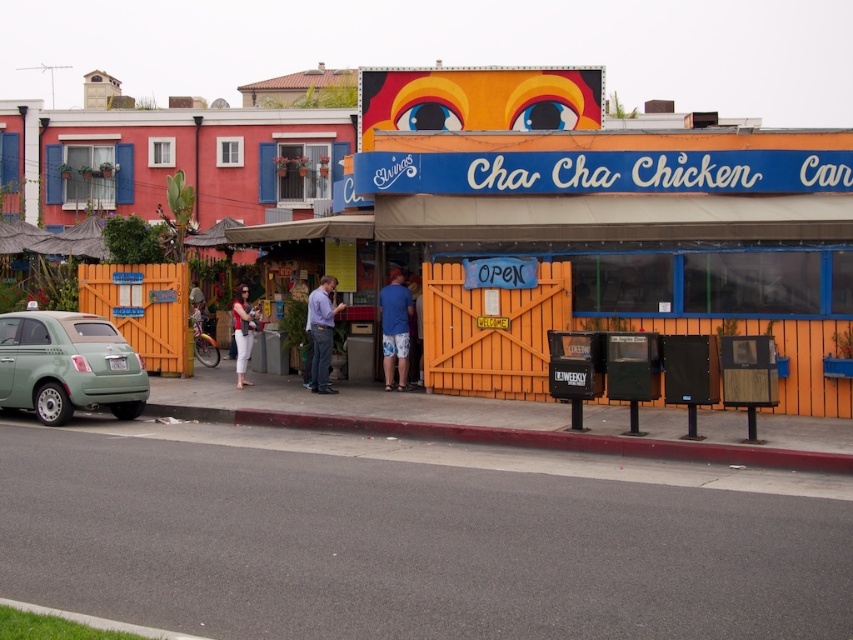
Question: Does matte green car at lower left come in front of matte white pants at center?

Choices:
 (A) yes
 (B) no

Answer: (A)

Question: Which point appears closest to the camera in this image?

Choices:
 (A) (325, 288)
 (B) (248, 317)

Answer: (A)

Question: Which of the following is the farthest from the observer?

Choices:
 (A) (310, 385)
 (B) (190, 413)
 (C) (241, 292)
 (D) (100, 362)

Answer: (C)

Question: Does matte green car at lower left have a larger size compared to blue shirt at center?

Choices:
 (A) no
 (B) yes

Answer: (B)

Question: Which of these objects is positioned farthest from the blue shirt at center?

Choices:
 (A) blue cotton shorts at center
 (B) red rubber curb at lower center
 (C) matte green car at lower left
 (D) matte white pants at center

Answer: (C)

Question: Does red rubber curb at lower center have a smaller size compared to matte white pants at center?

Choices:
 (A) no
 (B) yes

Answer: (B)